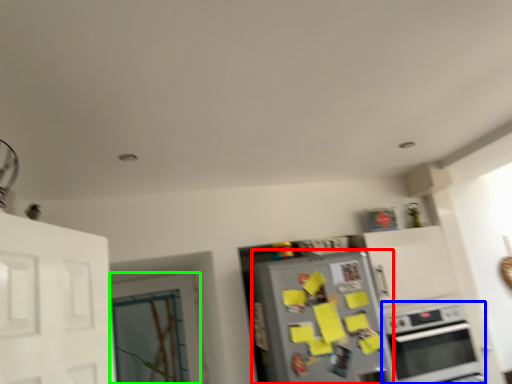
Question: Which is farther away from refrigerator (highlighted by a red box)? oven (highlighted by a blue box) or door (highlighted by a green box)?

Choices:
 (A) oven
 (B) door

Answer: (B)